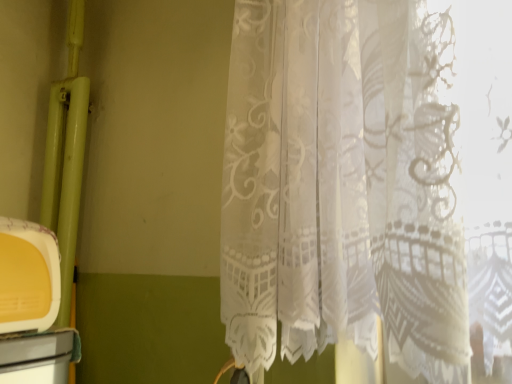
Locate an element on the screen. The image size is (512, 384). white lace curtain at right is located at coordinates (344, 184).

Image resolution: width=512 pixels, height=384 pixels. Describe the element at coordinates (344, 184) in the screenshot. I see `white lace curtain at right` at that location.

The width and height of the screenshot is (512, 384). In order to click on white lace curtain at right in this screenshot , I will do `click(344, 184)`.